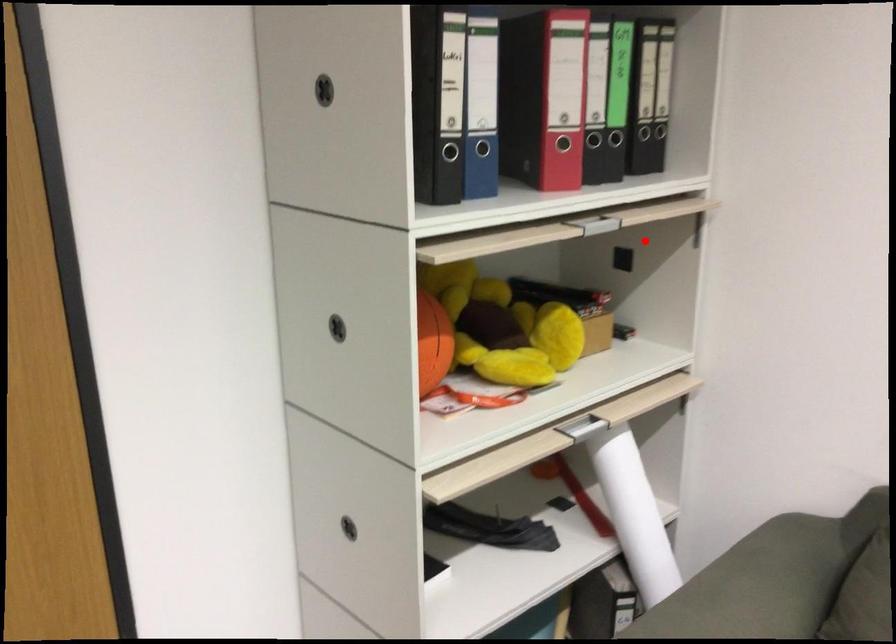
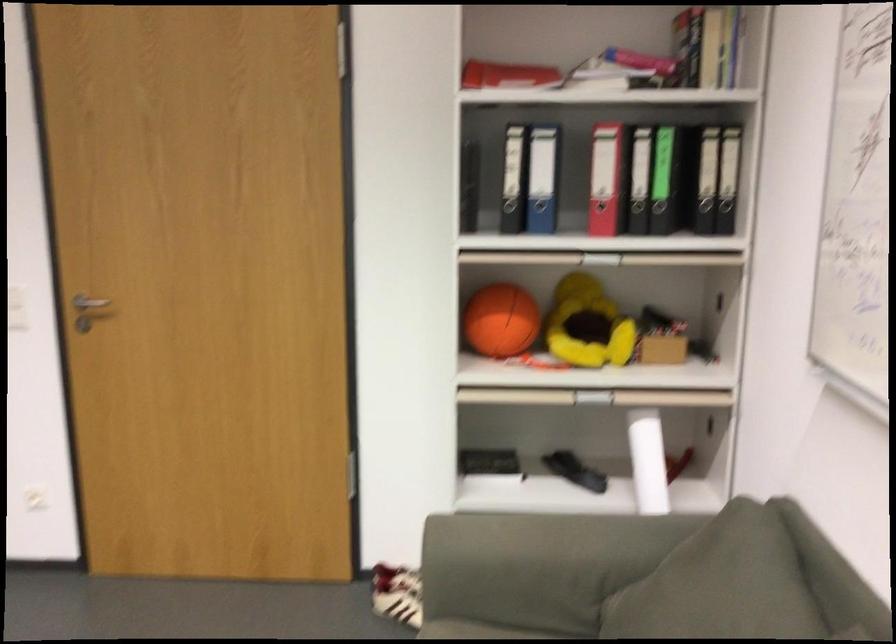
Find the pixel in the second image that matches the highlighted location in the first image.

(725, 283)